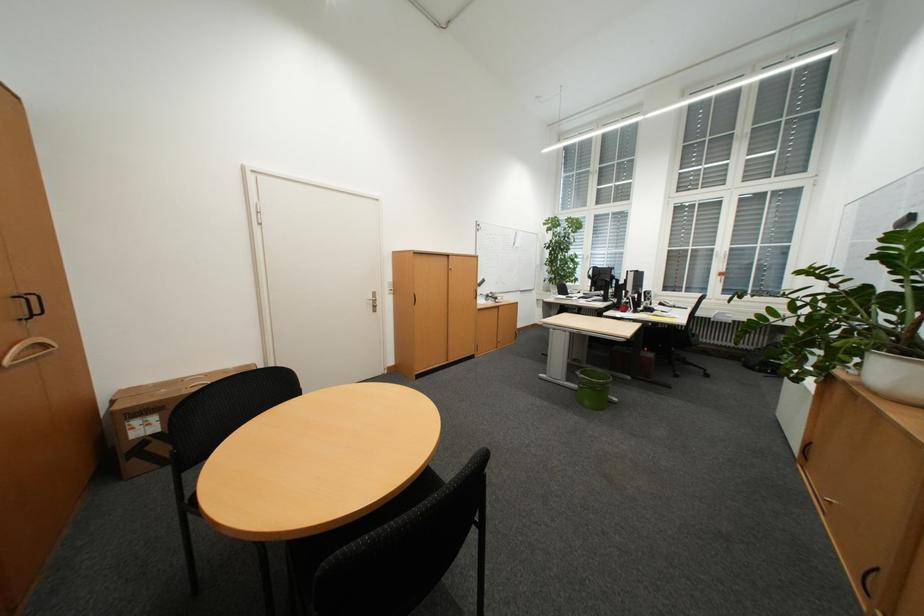
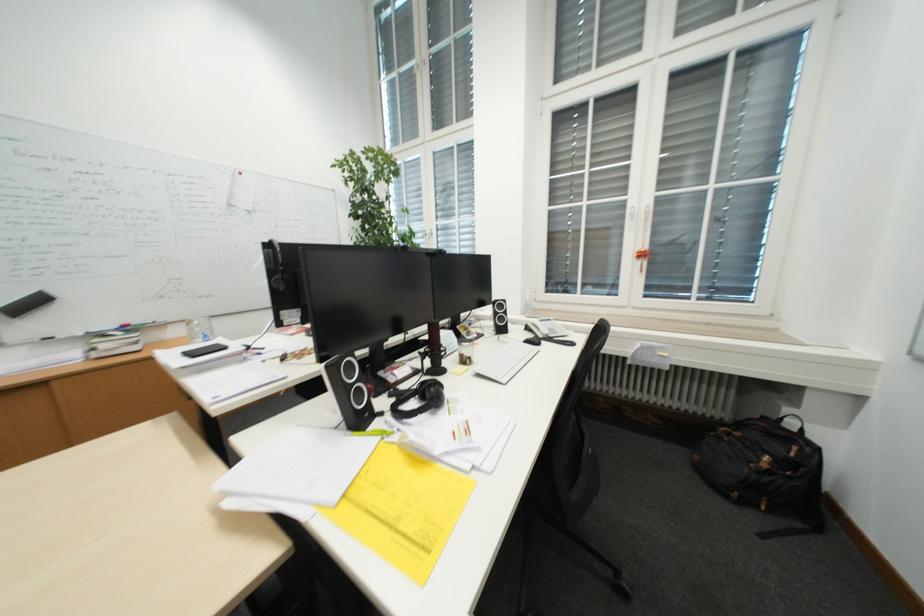
In a continuous first-person perspective shot, in which direction is the camera moving?

The cameraman moved toward right, forward.